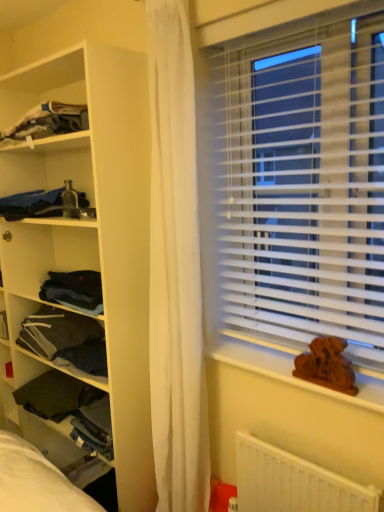
Question: Is dark gray fabric at left, the 3th clothing from the top, surrounded by dark blue fabric at upper left, arranged as the 1th clothing when viewed from the top?

Choices:
 (A) no
 (B) yes

Answer: (A)

Question: Is dark blue fabric at upper left, arranged as the 1th clothing when viewed from the top, oriented towards dark gray fabric at left, placed as the 2th clothing when sorted from bottom to top?

Choices:
 (A) yes
 (B) no

Answer: (B)

Question: From the image's perspective, is dark blue fabric at upper left, acting as the 4th clothing starting from the bottom, under dark gray fabric at left, the 3th clothing from the top?

Choices:
 (A) no
 (B) yes

Answer: (A)

Question: Is dark blue fabric at upper left, acting as the 4th clothing starting from the bottom, smaller than dark gray fabric at left, placed as the 2th clothing when sorted from bottom to top?

Choices:
 (A) yes
 (B) no

Answer: (A)

Question: Is dark blue fabric at upper left, arranged as the 1th clothing when viewed from the top, facing away from dark gray fabric at left, placed as the 2th clothing when sorted from bottom to top?

Choices:
 (A) no
 (B) yes

Answer: (A)

Question: Is point (114, 223) closer or farther from the camera than point (215, 354)?

Choices:
 (A) closer
 (B) farther

Answer: (A)

Question: Which is correct: white matte shelf at left is inside wooden carving at lower right, or outside of it?

Choices:
 (A) outside
 (B) inside

Answer: (A)

Question: Considering the positions of white matte shelf at left and wooden carving at lower right in the image, is white matte shelf at left wider or thinner than wooden carving at lower right?

Choices:
 (A) wide
 (B) thin

Answer: (A)

Question: From a real-world perspective, relative to wooden carving at lower right, is white matte shelf at left vertically above or below?

Choices:
 (A) above
 (B) below

Answer: (A)

Question: From their relative heights in the image, would you say white matte shelf at left is taller or shorter than matte black bottle at left, positioned as the second clothing in top-to-bottom order?

Choices:
 (A) tall
 (B) short

Answer: (A)

Question: Relative to matte black bottle at left, acting as the third clothing starting from the bottom, is white matte shelf at left in front or behind?

Choices:
 (A) front
 (B) behind

Answer: (A)

Question: In terms of size, does white matte shelf at left appear bigger or smaller than matte black bottle at left, acting as the third clothing starting from the bottom?

Choices:
 (A) small
 (B) big

Answer: (B)

Question: Is white matte shelf at left to the left or to the right of matte black bottle at left, acting as the third clothing starting from the bottom, in the image?

Choices:
 (A) left
 (B) right

Answer: (B)

Question: Visually, is dark green fabric at left, acting as the fourth clothing starting from the top, positioned to the left or to the right of white plastic radiator at lower right?

Choices:
 (A) left
 (B) right

Answer: (A)

Question: Is dark green fabric at left, acting as the fourth clothing starting from the top, in front of or behind white plastic radiator at lower right in the image?

Choices:
 (A) front
 (B) behind

Answer: (B)